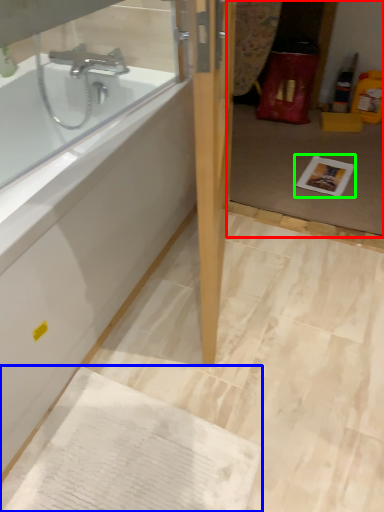
Question: Based on their relative distances, which object is nearer to glass door (highlighted by a red box)? Choose from cardboard (highlighted by a blue box) and copy (highlighted by a green box).

Choices:
 (A) cardboard
 (B) copy

Answer: (B)